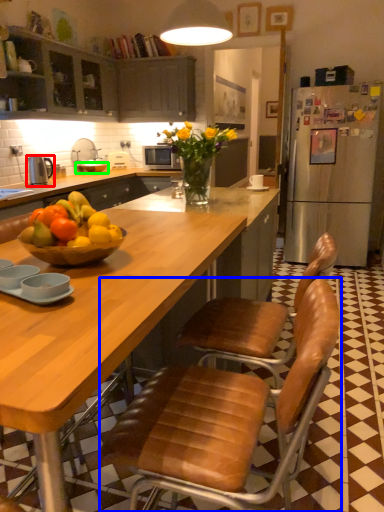
Question: Based on their relative distances, which object is farther from kitchen appliance (highlighted by a red box)? Choose from chair (highlighted by a blue box) and bowl (highlighted by a green box).

Choices:
 (A) chair
 (B) bowl

Answer: (A)